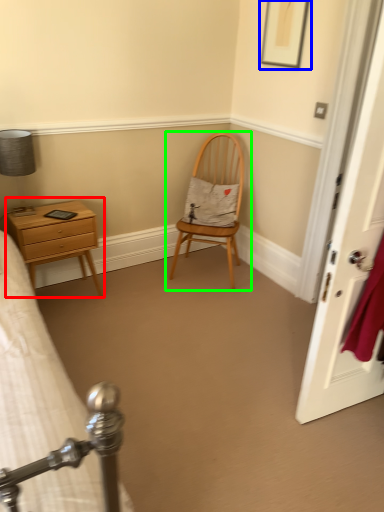
Question: Which is nearer to the nightstand (highlighted by a red box)? picture frame (highlighted by a blue box) or chair (highlighted by a green box).

Choices:
 (A) picture frame
 (B) chair

Answer: (B)